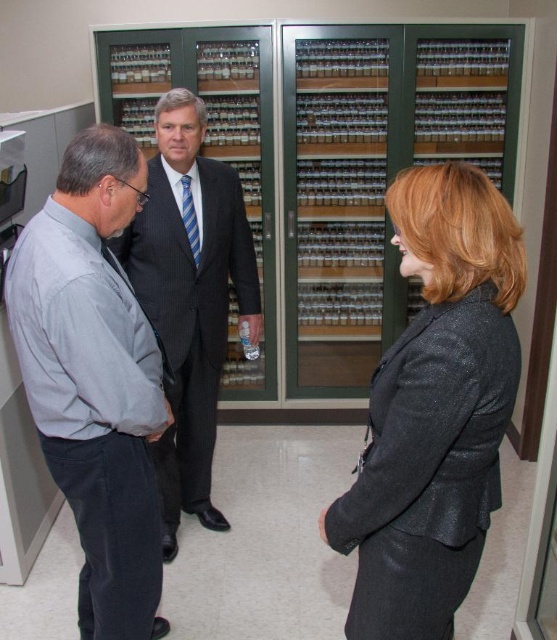
Question: Which is nearer to the gray shirt at left?

Choices:
 (A) sparkly black blazer at center
 (B) dark gray pinstripe suit at center

Answer: (B)

Question: Which point is farther to the camera?

Choices:
 (A) gray shirt at left
 (B) dark gray pinstripe suit at center
 (C) sparkly black blazer at center

Answer: (B)

Question: Among these points, which one is farthest from the camera?

Choices:
 (A) (209, 381)
 (B) (407, 179)
 (C) (157, 413)

Answer: (A)

Question: Can you confirm if sparkly black blazer at center is smaller than dark gray pinstripe suit at center?

Choices:
 (A) yes
 (B) no

Answer: (A)

Question: From the image, what is the correct spatial relationship of sparkly black blazer at center in relation to dark gray pinstripe suit at center?

Choices:
 (A) left
 (B) right

Answer: (B)

Question: In this image, where is sparkly black blazer at center located relative to gray shirt at left?

Choices:
 (A) right
 (B) left

Answer: (A)